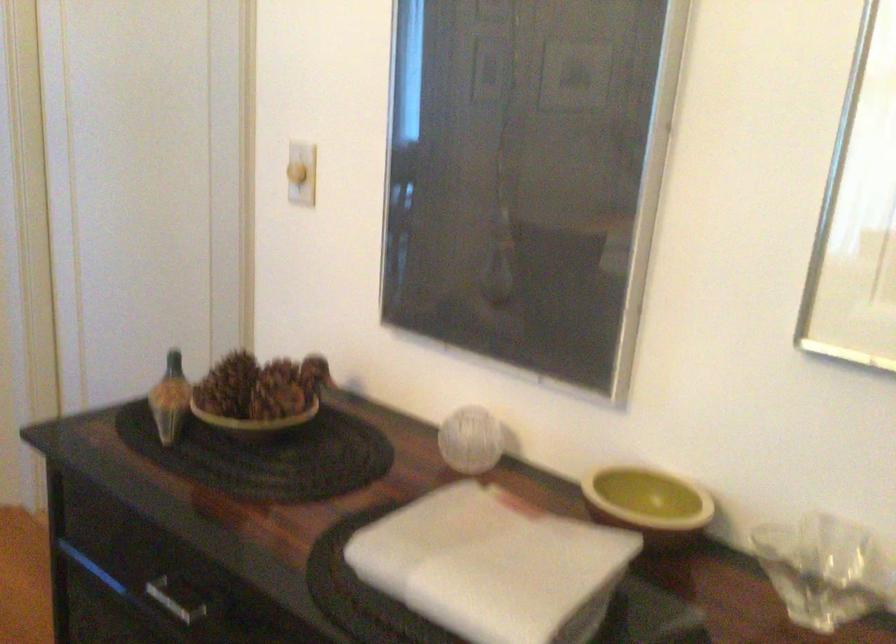
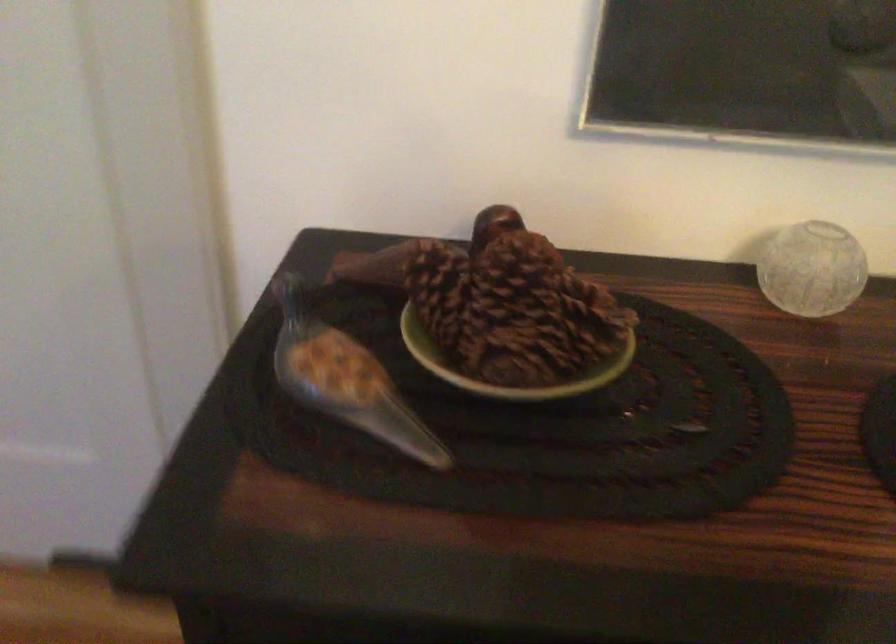
Based on the continuous images, in which direction is the camera rotating?

The camera's rotation is toward right-down.